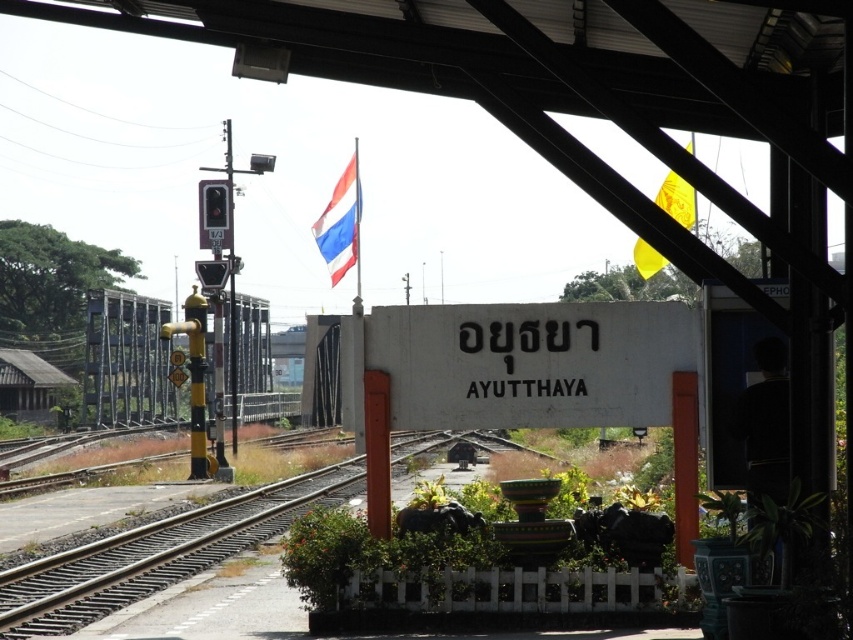
You are a traveler standing at the Ayutthaya railway station platform. You notice two flags, the polished fabric flag at upper center and the yellow fabric flag at upper right. Which flag is taller?

The polished fabric flag at upper center is taller than the yellow fabric flag at upper right.

You are a tourist at Ayutthaya railway station and you see two flags, the polished fabric flag at upper center and the yellow fabric flag at upper right. Which flag is wider?

The polished fabric flag at upper center might be wider than yellow fabric flag at upper right.

You are a tourist standing on the Ayutthaya railway platform and see the polished fabric flag at upper center and the yellow fabric flag at upper right. Which flag is closer to you?

The polished fabric flag at upper center is closer to you because it is further to the viewer than the yellow fabric flag at upper right.